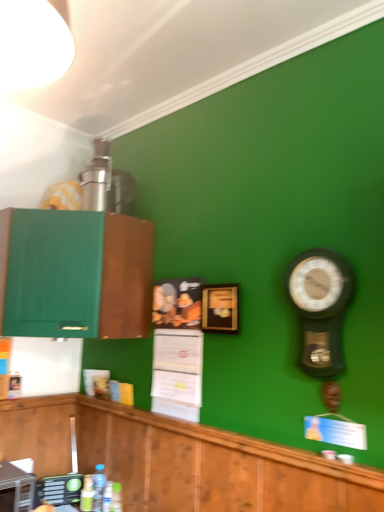
Question: Is the depth of translucent plastic bottle at lower center, positioned as the 2th bottle in right-to-left order, greater than that of wooden picture frame at center?

Choices:
 (A) no
 (B) yes

Answer: (B)

Question: Is translucent plastic bottle at lower center, positioned as the 2th bottle in right-to-left order, smaller than wooden picture frame at center?

Choices:
 (A) no
 (B) yes

Answer: (B)

Question: Is translucent plastic bottle at lower center, the 3th bottle positioned from the left, closer to camera compared to wooden picture frame at center?

Choices:
 (A) no
 (B) yes

Answer: (A)

Question: From the image's perspective, is translucent plastic bottle at lower center, the 3th bottle positioned from the left, located beneath wooden picture frame at center?

Choices:
 (A) no
 (B) yes

Answer: (B)

Question: From a real-world perspective, is translucent plastic bottle at lower center, the 3th bottle positioned from the left, under wooden picture frame at center?

Choices:
 (A) no
 (B) yes

Answer: (B)

Question: Can you confirm if translucent plastic bottle at lower center, the 3th bottle positioned from the left, is positioned to the left of wooden picture frame at center?

Choices:
 (A) no
 (B) yes

Answer: (B)

Question: Is metallic silver toaster at lower left, positioned as the first appliance in front-to-back order, next to clear plastic bottle at lower center, positioned as the third bottle in right-to-left order?

Choices:
 (A) yes
 (B) no

Answer: (B)

Question: Is metallic silver toaster at lower left, which is counted as the second appliance, starting from the back, taller than clear plastic bottle at lower center, positioned as the third bottle in right-to-left order?

Choices:
 (A) yes
 (B) no

Answer: (A)

Question: Could clear plastic bottle at lower center, positioned as the third bottle in right-to-left order, be considered to be inside metallic silver toaster at lower left, which is counted as the second appliance, starting from the back?

Choices:
 (A) no
 (B) yes

Answer: (A)

Question: Is metallic silver toaster at lower left, which is counted as the second appliance, starting from the back, bigger than clear plastic bottle at lower center, which is the second bottle in left-to-right order?

Choices:
 (A) yes
 (B) no

Answer: (A)

Question: Is metallic silver toaster at lower left, which is counted as the second appliance, starting from the back, not inside clear plastic bottle at lower center, which is the second bottle in left-to-right order?

Choices:
 (A) yes
 (B) no

Answer: (A)

Question: From the image's perspective, is metallic silver toaster at lower left, positioned as the first appliance in front-to-back order, located beneath clear plastic bottle at lower center, which is the second bottle in left-to-right order?

Choices:
 (A) no
 (B) yes

Answer: (A)

Question: Does metallic silver toaster at lower left, positioned as the first appliance in front-to-back order, appear on the right side of translucent plastic bottles at lower center, the 4th bottle when ordered from left to right?

Choices:
 (A) no
 (B) yes

Answer: (A)